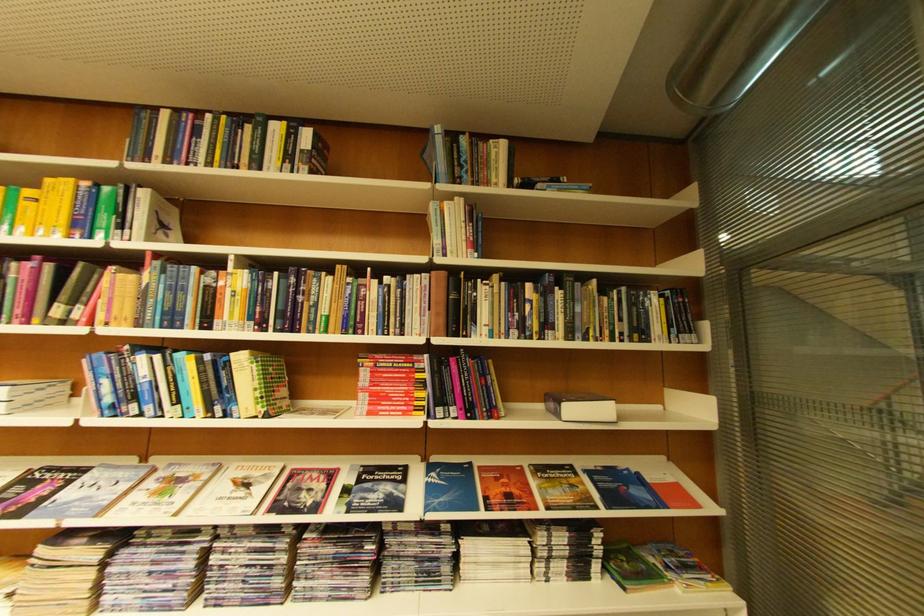
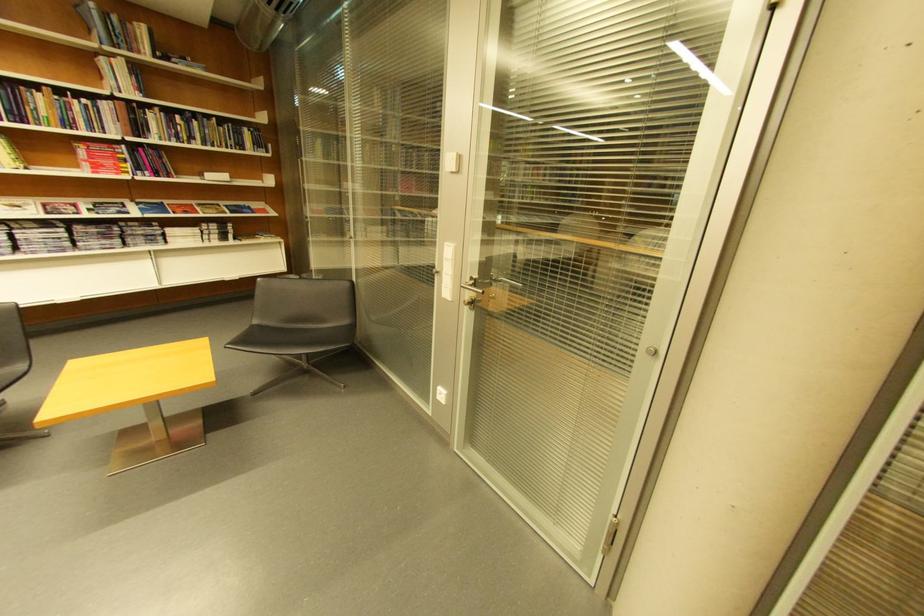
Find the pixel in the second image that matches (569,294) in the first image.

(205, 124)